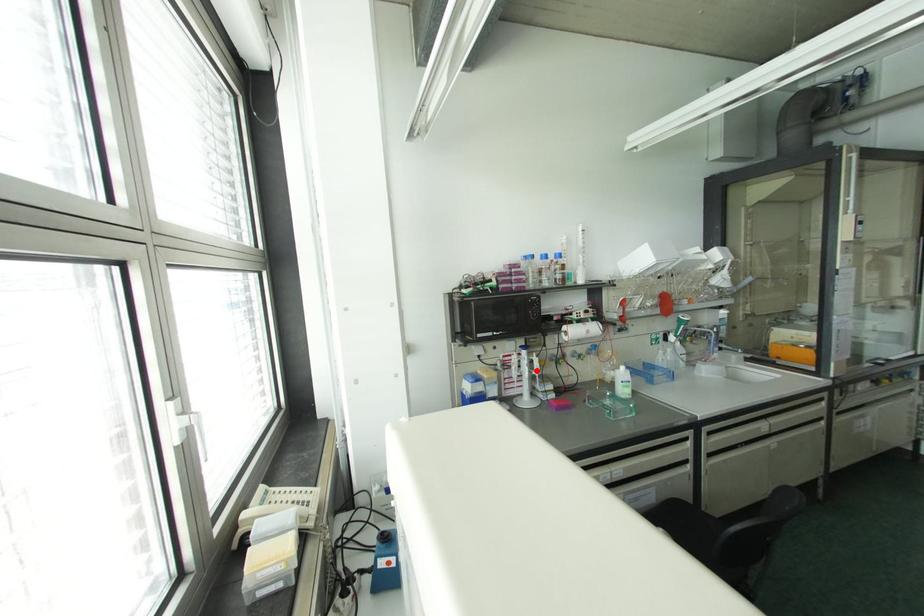
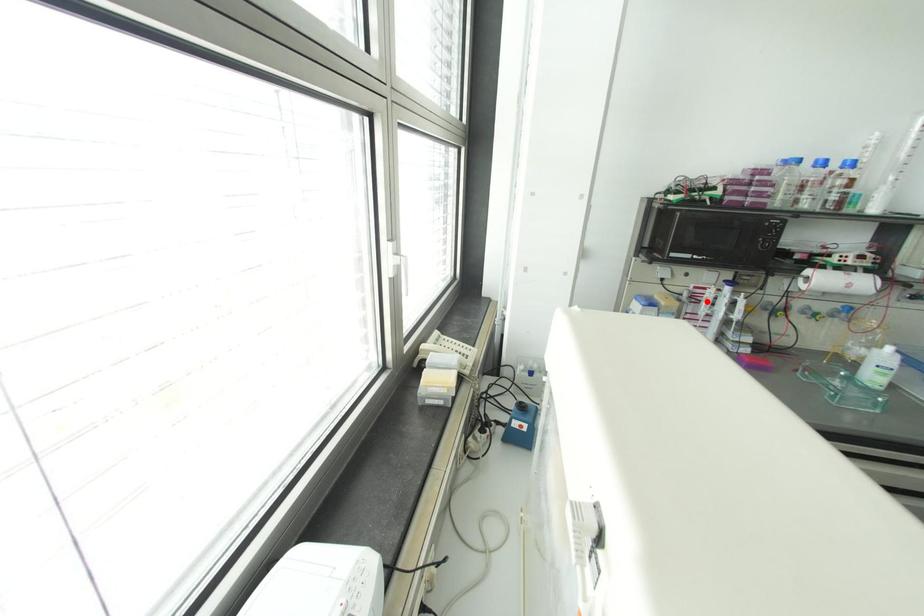
I am providing you with two images of the same scene from different viewpoints. A red point is marked on the first image and another point is marked on the second image. Are the points marked in image1 and image2 representing the same 3D position?

No